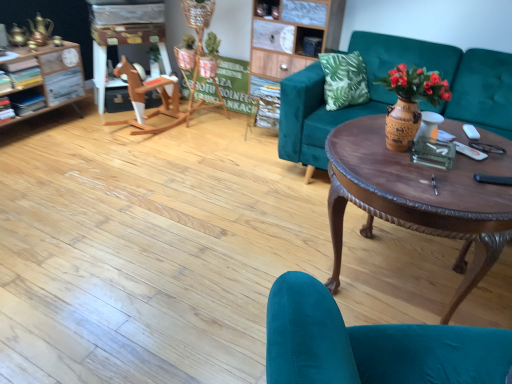
At what (x,y) coordinates should I click in order to perform the action: click on vacant space to the left of wooden rocking horse at left. Please return your answer as a coordinate pair (x, y). Looking at the image, I should click on (76, 129).